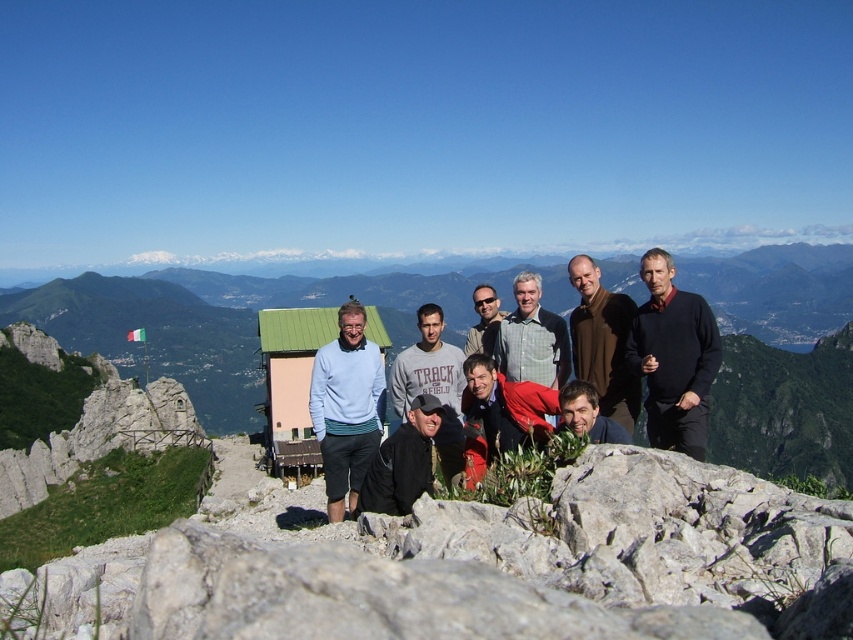
Where is the black cotton shirt at center located in the image?

The black cotton shirt at center is located at point (672, 356) in the image.

You are a photographer trying to capture a photo of the black cotton shirt at center and the light blue sweater at center. Which one is positioned higher in the frame?

The black cotton shirt at center is positioned higher in the frame than the light blue sweater at center.